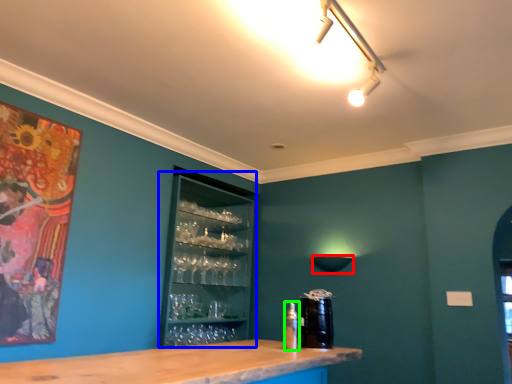
Question: Considering the real-world distances, which object is closest to lamp (highlighted by a red box)? drink (highlighted by a blue box) or bottle (highlighted by a green box).

Choices:
 (A) drink
 (B) bottle

Answer: (A)